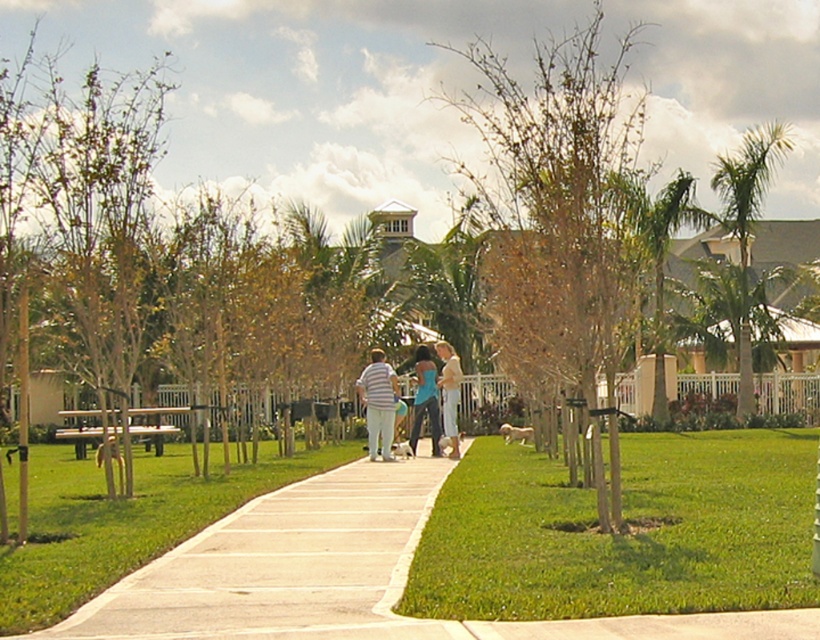
Question: Considering the real-world distances, which object is closest to the striped cotton shirt at center?

Choices:
 (A) green grass at lower right
 (B) green leafy palm tree at right
 (C) teal fabric tank top at center
 (D) concrete at center

Answer: (C)

Question: Which point is closer to the camera?

Choices:
 (A) (413, 404)
 (B) (572, 291)
 (C) (348, 541)

Answer: (C)

Question: Can you confirm if brown leafy tree at center is positioned to the left of striped cotton shirt at center?

Choices:
 (A) no
 (B) yes

Answer: (A)

Question: Which object is the closest to the green grass at lower right?

Choices:
 (A) brown leafy tree at center
 (B) green leafy palm tree at right
 (C) concrete at center
 (D) striped cotton shirt at center

Answer: (C)

Question: Can you confirm if striped cotton shirt at center is wider than teal fabric tank top at center?

Choices:
 (A) no
 (B) yes

Answer: (A)

Question: Is the position of striped cotton shirt at center less distant than that of light blue denim jeans at center?

Choices:
 (A) yes
 (B) no

Answer: (A)